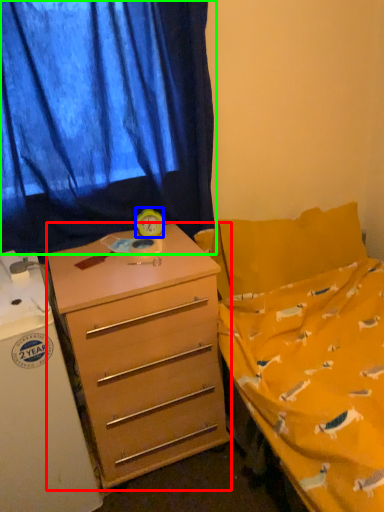
Question: Which object is positioned closest to desk (highlighted by a red box)? Select from clock (highlighted by a blue box) and curtain (highlighted by a green box).

Choices:
 (A) clock
 (B) curtain

Answer: (A)